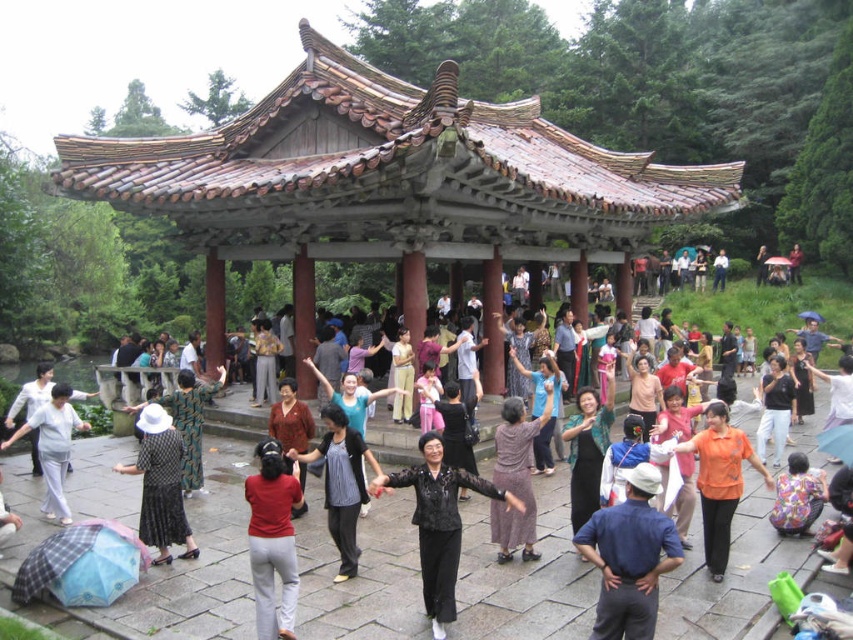
In the scene shown: Can you confirm if blue cotton shirt at center is positioned to the right of black matte pants at center?

Yes, blue cotton shirt at center is to the right of black matte pants at center.

Does blue cotton shirt at center have a lesser width compared to black matte pants at center?

No, blue cotton shirt at center is not thinner than black matte pants at center.

The width and height of the screenshot is (853, 640). I want to click on blue cotton shirt at center, so click(630, 557).

Is rusty metal gazebo at center above blue cotton shirt at center?

Yes.

Is point (392, 104) closer to viewer compared to point (595, 614)?

That is False.

Is point (498, 291) in front of point (596, 525)?

That is False.

This screenshot has height=640, width=853. What are the coordinates of `rusty metal gazebo at center` in the screenshot? It's located at (392, 189).

Does rusty metal gazebo at center appear on the left side of black matte pants at center?

Indeed, rusty metal gazebo at center is positioned on the left side of black matte pants at center.

Measure the distance between point (200, 232) and camera.

They are 46.85 meters apart.

Is point (616, 156) behind point (453, 564)?

Yes, it is.

The height and width of the screenshot is (640, 853). I want to click on rusty metal gazebo at center, so click(x=392, y=189).